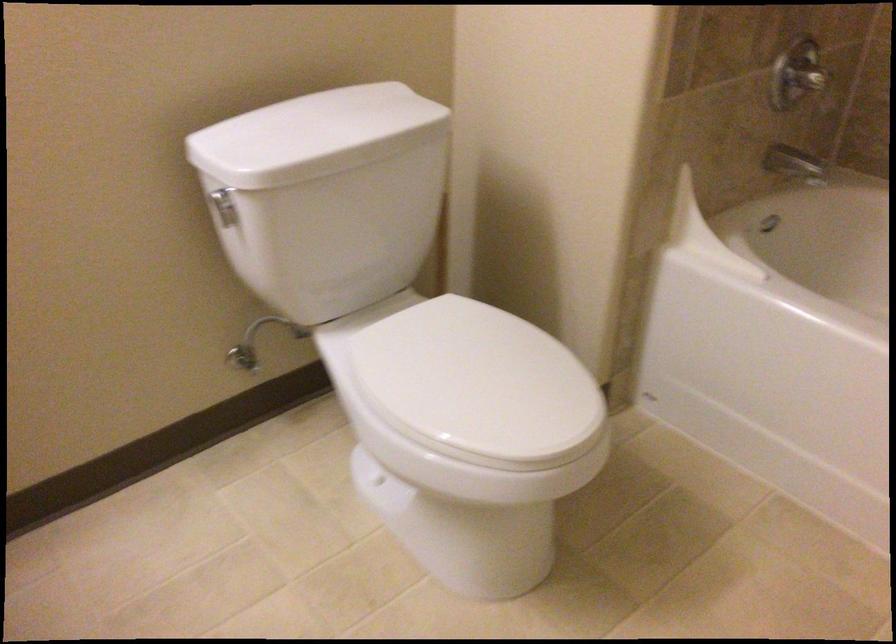
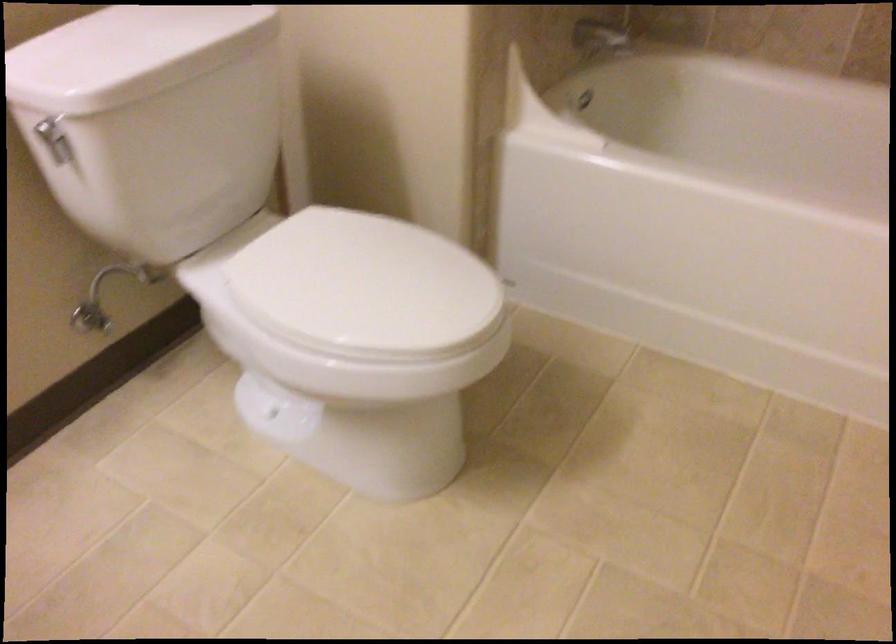
Question: In a continuous first-person perspective shot, in which direction is the camera moving?

Choices:
 (A) Left
 (B) Right
 (C) Forward
 (D) Backward

Answer: (A)